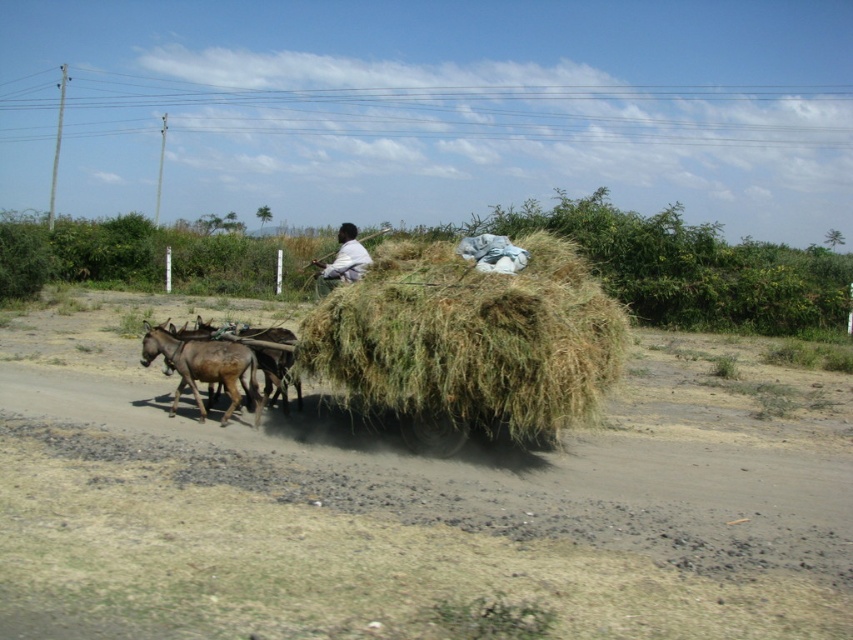
Question: Which point is closer to the camera taking this photo?

Choices:
 (A) (613, 340)
 (B) (227, 381)

Answer: (A)

Question: Considering the relative positions of brown rough mule at left and white cotton shirt at center in the image provided, where is brown rough mule at left located with respect to white cotton shirt at center?

Choices:
 (A) above
 (B) below

Answer: (B)

Question: Is brown rough mule at left above white cotton shirt at center?

Choices:
 (A) yes
 (B) no

Answer: (B)

Question: Which point is closer to the camera?

Choices:
 (A) (349, 237)
 (B) (433, 260)
 (C) (218, 381)

Answer: (B)

Question: Which is nearer to the green straw at center?

Choices:
 (A) brown rough mule at left
 (B) white cotton shirt at center

Answer: (B)

Question: Is green straw at center smaller than white cotton shirt at center?

Choices:
 (A) yes
 (B) no

Answer: (A)